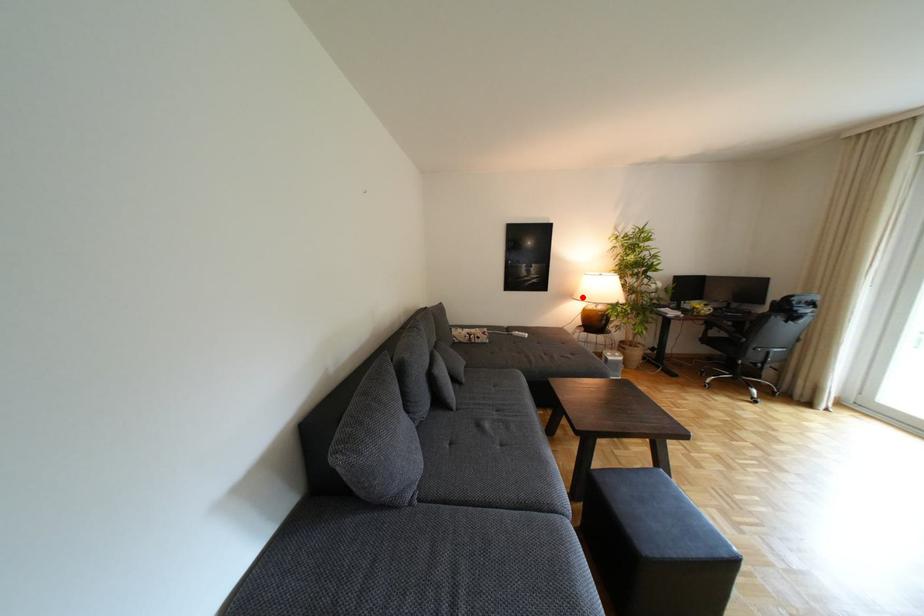
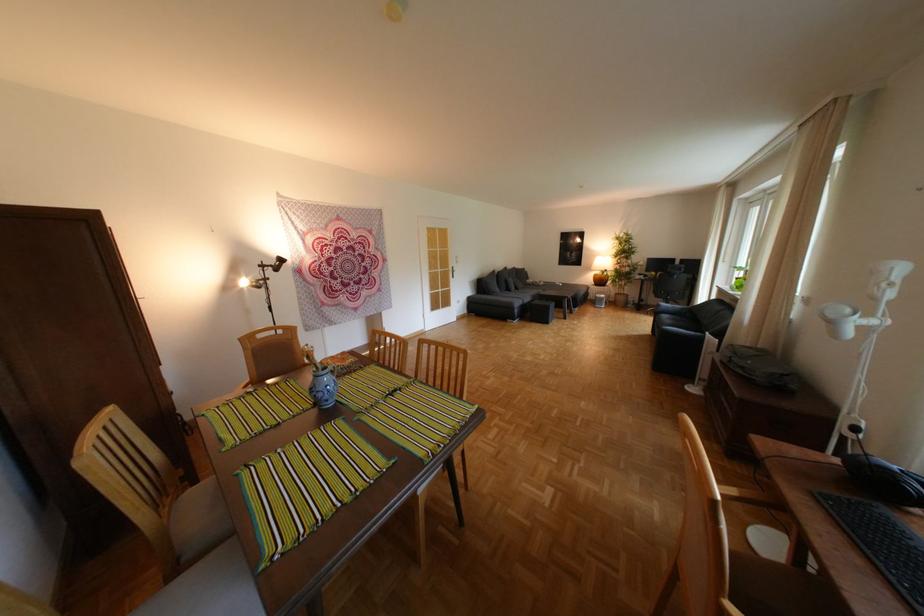
Question: I am providing you with two images of the same scene from different viewpoints. A red point is shown in image1. For the corresponding object point in image2, is it positioned nearer or farther from the camera?

Choices:
 (A) Nearer
 (B) Farther

Answer: (A)